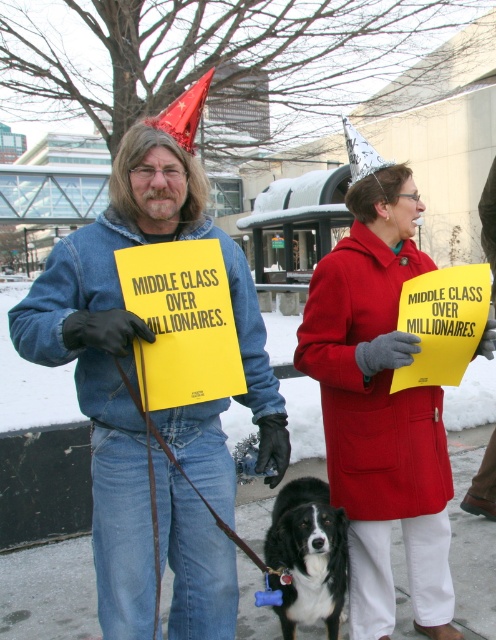
You are a photographer trying to capture a clear photo of the matte red coat at center and the black fur dog at center. What is the minimum distance you need to maintain between the camera and the subjects to ensure both are in focus?

The matte red coat at center and black fur dog at center are 14.23 inches apart from each other. To ensure both are in focus, the camera should be positioned at least 14.23 inches away from the closest subject.

You are a photographer trying to capture a clear picture of the denim jacket at center and the black fur dog at center. Which one will appear closer to the camera in the photo?

The denim jacket at center is in front of the black fur dog at center, so it will appear closer to the camera in the photo.

You are a photographer trying to capture a clear shot of the matte red coat at center and the black fur dog at center. Based on their heights, which object should you focus on first if you want to ensure both are in frame without cropping?

The matte red coat at center is taller than the black fur dog at center, so you should focus on the matte red coat at center first to ensure both are in frame without cropping.